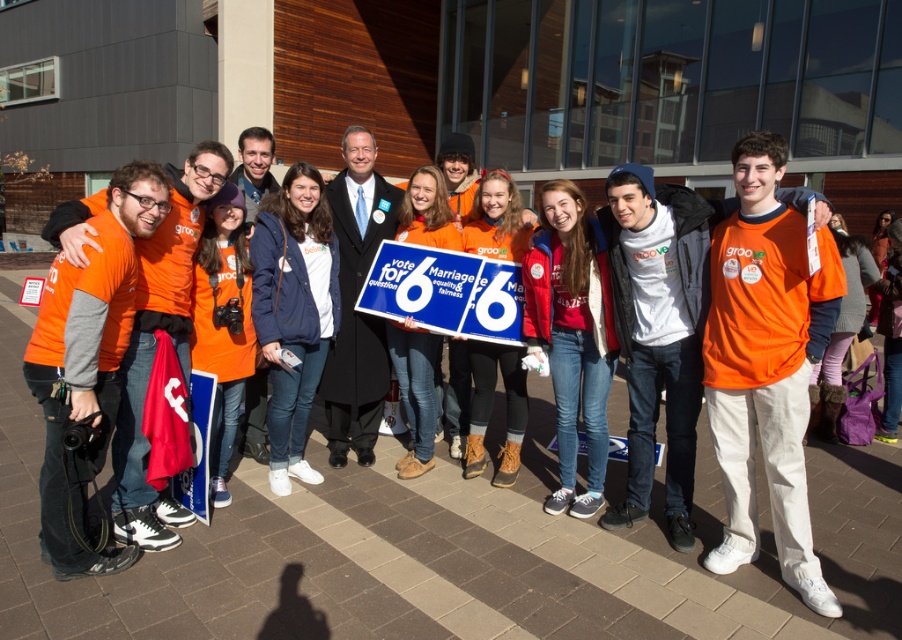
Between point (288, 456) and point (512, 396), which one is positioned behind?

The point (512, 396) is behind.

Does navy blue jacket at center lie behind orange fleece jacket at center?

That is False.

You are a GUI agent. You are given a task and a screenshot of the screen. Output one action in this format:
    pyautogui.click(x=<x>, y=<y>)
    Task: Click on the navy blue jacket at center
    
    Given the screenshot: What is the action you would take?
    pyautogui.click(x=293, y=310)

Identify the location of navy blue jacket at center. (293, 310).

Is navy blue jacket at center above orange matte jacket at center?

Yes, navy blue jacket at center is above orange matte jacket at center.

Is navy blue jacket at center below orange matte jacket at center?

Incorrect, navy blue jacket at center is not positioned below orange matte jacket at center.

The image size is (902, 640). In order to click on navy blue jacket at center in this screenshot , I will do `click(293, 310)`.

Is red fleece jacket at center positioned behind orange matte jacket at center?

That is True.

Who is more forward, (534, 284) or (227, 340)?

Result: Point (227, 340) is in front.

Which is behind, point (568, 212) or point (224, 332)?

The point (224, 332) is behind.

Where is `red fleece jacket at center`? The image size is (902, 640). red fleece jacket at center is located at coordinates (572, 333).